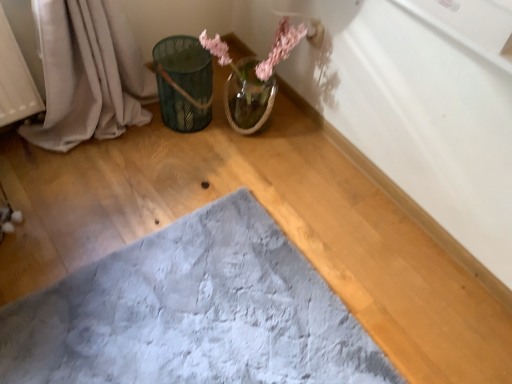
Image resolution: width=512 pixels, height=384 pixels. What are the coordinates of `vacant space behind soft gray plush bath mat at center` in the screenshot? It's located at (226, 185).